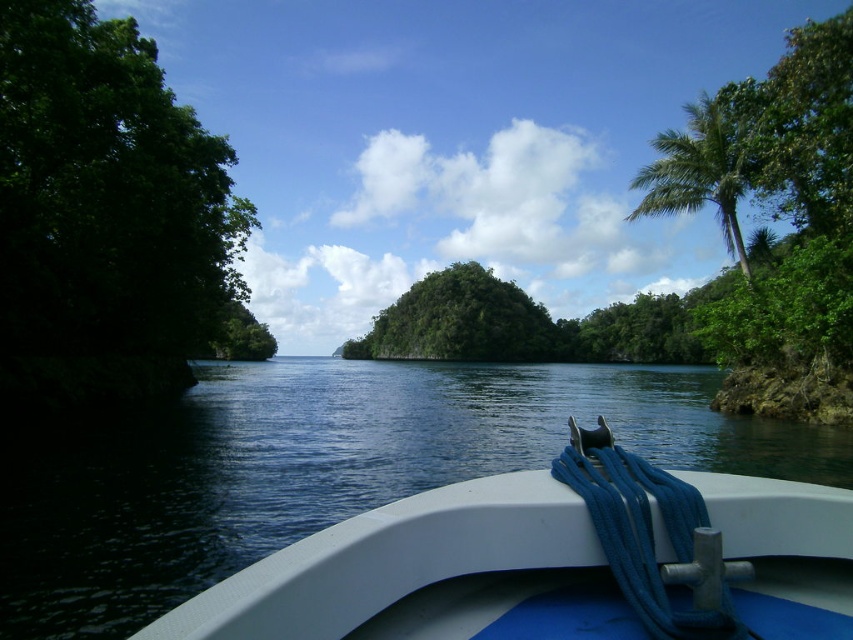
You are standing on the deck of the white plastic boat at lower center and want to tie the blue rope to the green leafy tree at left. Can you reach the tree with the rope?

The white plastic boat at lower center is thinner than the green leafy tree at left, but the question of rope length isn not addressed in the provided description. Therefore, based on the given information, we cannot determine if the blue rope is long enough to reach the tree.

You are standing on the deck of the boat and want to secure the blue rope to the metal cleat. The cleat is located at point (555,561). Is the white plastic boat at lower center in the way of the cleat?

The white plastic boat at lower center is located at point (555,561), which is the same location as the cleat. Therefore, the boat is directly at that point, so it might be in the way of the cleat depending on the boat design.